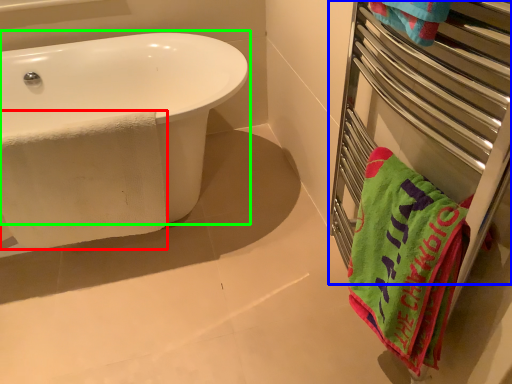
Question: Which object is the farthest from beach towel (highlighted by a red box)? Choose among these: balustrade (highlighted by a blue box) or bathtub (highlighted by a green box).

Choices:
 (A) balustrade
 (B) bathtub

Answer: (A)